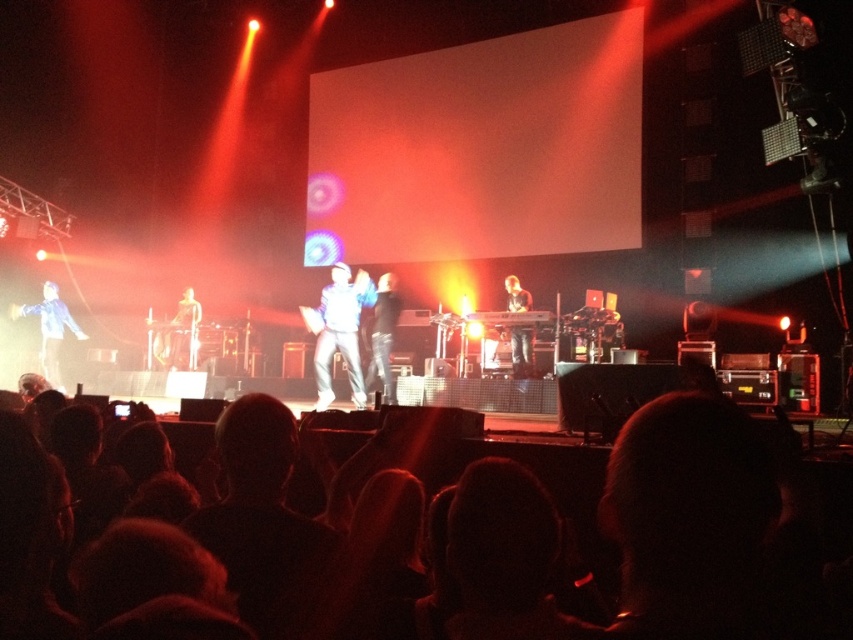
Question: Observing the image, what is the correct spatial positioning of white fabric jacket at center in reference to matte white figure at center?

Choices:
 (A) right
 (B) left

Answer: (A)

Question: Is white matte jacket at center to the left of dark blue jeans at center from the viewer's perspective?

Choices:
 (A) yes
 (B) no

Answer: (A)

Question: Which object appears closest to the camera in this image?

Choices:
 (A) denim jacket at left
 (B) black hair at lower center

Answer: (B)

Question: Which point appears closest to the camera in this image?

Choices:
 (A) (326, 368)
 (B) (508, 288)

Answer: (A)

Question: Is white matte jacket at center thinner than denim jacket at left?

Choices:
 (A) no
 (B) yes

Answer: (B)

Question: Estimate the real-world distances between objects in this image. Which object is farther from the matte white figure at center?

Choices:
 (A) white matte jacket at center
 (B) denim jacket at left
 (C) white fabric jacket at center

Answer: (C)